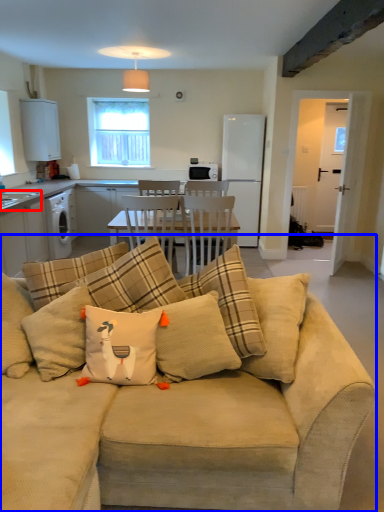
Question: Which point is further to the camera, sink (highlighted by a red box) or studio couch (highlighted by a blue box)?

Choices:
 (A) sink
 (B) studio couch

Answer: (A)